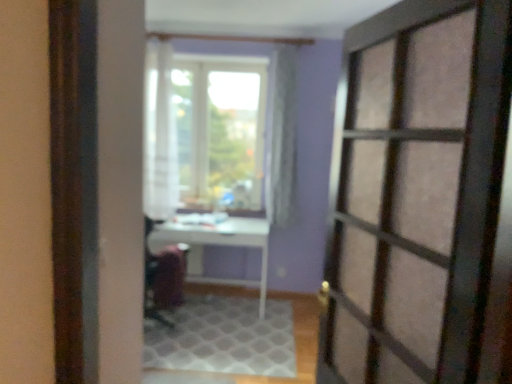
Image resolution: width=512 pixels, height=384 pixels. What do you see at coordinates (161, 132) in the screenshot? I see `white sheer curtain at center` at bounding box center [161, 132].

This screenshot has width=512, height=384. In order to click on matte glass door at right in this screenshot , I will do `click(419, 196)`.

Where is `velvet-like burgundy armchair at center`? The width and height of the screenshot is (512, 384). velvet-like burgundy armchair at center is located at coordinates (163, 278).

Where is `white glossy table at center`? This screenshot has width=512, height=384. white glossy table at center is located at coordinates (220, 240).

Describe the element at coordinates (224, 338) in the screenshot. I see `white textured rug at center` at that location.

Find the location of a particular element. The width and height of the screenshot is (512, 384). white sheer curtain at center is located at coordinates (161, 132).

Is white textured rug at center touching matte glass door at right?

There is a gap between white textured rug at center and matte glass door at right.

Based on the photo, in terms of height, does white textured rug at center look taller or shorter compared to matte glass door at right?

Clearly, white textured rug at center is shorter compared to matte glass door at right.

Which is behind, white textured rug at center or matte glass door at right?

white textured rug at center.

Is white sheer curtain at center oriented towards matte glass door at right?

No, white sheer curtain at center is not turned towards matte glass door at right.

Between white sheer curtain at center and matte glass door at right, which one has more height?

Standing taller between the two is white sheer curtain at center.

Is white sheer curtain at center far from matte glass door at right?

Yes, white sheer curtain at center and matte glass door at right are located far from each other.

Considering the relative sizes of white sheer curtain at center and matte glass door at right in the image provided, is white sheer curtain at center bigger than matte glass door at right?

No.

Is the depth of matte glass door at right greater than that of velvet-like burgundy armchair at center?

No, matte glass door at right is closer to the camera.

Does point (389, 123) come farther from viewer compared to point (147, 253)?

No, (389, 123) is in front of (147, 253).

Does matte glass door at right have a lesser height compared to velvet-like burgundy armchair at center?

No.

Are matte glass door at right and velvet-like burgundy armchair at center beside each other?

No.

From a real-world perspective, which object stands above the other?

white glossy table at center.

Is velvet-like burgundy armchair at center turned away from white glossy table at center?

No.

Is velvet-like burgundy armchair at center to the right of white glossy table at center from the viewer's perspective?

Incorrect, velvet-like burgundy armchair at center is not on the right side of white glossy table at center.

Is velvet-like burgundy armchair at center wider than white glossy table at center?

No.

Does matte glass door at right have a larger size compared to white glossy table at center?

No.

Are matte glass door at right and white glossy table at center beside each other?

No, matte glass door at right is not next to white glossy table at center.

Is matte glass door at right taller than white glossy table at center?

Yes.

Which object is positioned more to the left, matte glass door at right or white glossy table at center?

Positioned to the left is white glossy table at center.

Is white sheer curtain at center facing away from white textured rug at center?

white sheer curtain at center is not turned away from white textured rug at center.

Considering the relative sizes of white sheer curtain at center and white textured rug at center in the image provided, is white sheer curtain at center smaller than white textured rug at center?

Incorrect, white sheer curtain at center is not smaller in size than white textured rug at center.

Is white textured rug at center inside white sheer curtain at center?

Actually, white textured rug at center is outside white sheer curtain at center.

From the picture: Can you confirm if white textured rug at center is smaller than velvet-like burgundy armchair at center?

Actually, white textured rug at center might be larger than velvet-like burgundy armchair at center.

From a real-world perspective, is white textured rug at center on top of velvet-like burgundy armchair at center?

No.

From the image's perspective, relative to velvet-like burgundy armchair at center, is white textured rug at center above or below?

white textured rug at center is below velvet-like burgundy armchair at center.

Is white textured rug at center directly adjacent to velvet-like burgundy armchair at center?

No.

Identify the location of door located in front of the white textured rug at center. The height and width of the screenshot is (384, 512). (419, 196).

The height and width of the screenshot is (384, 512). I want to click on curtain on the left of matte glass door at right, so tap(161, 132).

Based on their spatial positions, is white textured rug at center or white sheer curtain at center further from white glossy table at center?

white sheer curtain at center lies further to white glossy table at center than the other object.

Estimate the real-world distances between objects in this image. Which object is further from white textured rug at center, velvet-like burgundy armchair at center or matte glass door at right?

matte glass door at right.

Looking at the image, which one is located closer to matte glass door at right, white textured rug at center or velvet-like burgundy armchair at center?

Based on the image, white textured rug at center appears to be nearer to matte glass door at right.

Considering their positions, is white textured rug at center positioned further to white glossy table at center than velvet-like burgundy armchair at center?

white textured rug at center.

From the image, which object appears to be farther from matte glass door at right, white glossy table at center or white textured rug at center?

white glossy table at center.

Which object lies nearer to the anchor point velvet-like burgundy armchair at center, white glossy table at center or matte glass door at right?

white glossy table at center lies closer to velvet-like burgundy armchair at center than the other object.

Estimate the real-world distances between objects in this image. Which object is closer to velvet-like burgundy armchair at center, white glossy table at center or white sheer curtain at center?

white glossy table at center is closer to velvet-like burgundy armchair at center.

Looking at the image, which one is located further to white sheer curtain at center, velvet-like burgundy armchair at center or matte glass door at right?

Based on the image, matte glass door at right appears to be further to white sheer curtain at center.

This screenshot has width=512, height=384. I want to click on armchair between matte glass door at right and white glossy table at center from front to back, so click(x=163, y=278).

In order to click on table between white sheer curtain at center and velvet-like burgundy armchair at center in the vertical direction in this screenshot , I will do `click(220, 240)`.

Identify the location of doormat between matte glass door at right and white glossy table at center from front to back. This screenshot has width=512, height=384. (224, 338).

Where is `armchair between white textured rug at center and white glossy table at center in the front-back direction`? Image resolution: width=512 pixels, height=384 pixels. armchair between white textured rug at center and white glossy table at center in the front-back direction is located at coordinates (163, 278).